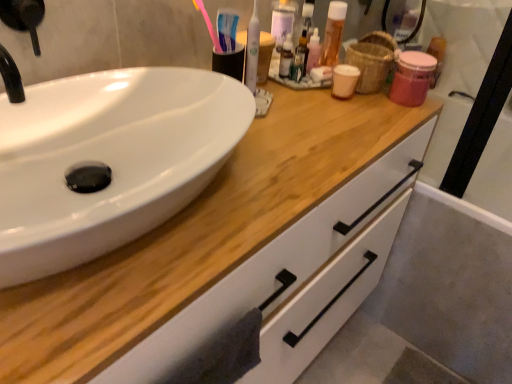
Question: From their relative heights in the image, would you say pink plastic toothbrush at upper center is taller or shorter than wooden cabinet at center?

Choices:
 (A) tall
 (B) short

Answer: (B)

Question: Does point (200, 3) appear closer or farther from the camera than point (330, 134)?

Choices:
 (A) closer
 (B) farther

Answer: (B)

Question: Which is farther from the pink plastic toothbrush at upper center?

Choices:
 (A) brown woven basket at upper right
 (B) translucent plastic mouthwash at upper center, which is counted as the second mouthwash, starting from the front
 (C) white plastic toothbrush at upper center, the 1th mouthwash from the left
 (D) white glossy sink at left
 (E) wooden cabinet at center

Answer: (A)

Question: Which object is positioned closest to the wooden cabinet at center?

Choices:
 (A) pink plastic toothbrush at upper center
 (B) translucent plastic mouthwash at upper center, which is counted as the first mouthwash, starting from the right
 (C) white plastic toothbrush at upper center, which ranks as the second mouthwash in back-to-front order
 (D) white glossy sink at left
 (E) brown woven basket at upper right

Answer: (D)